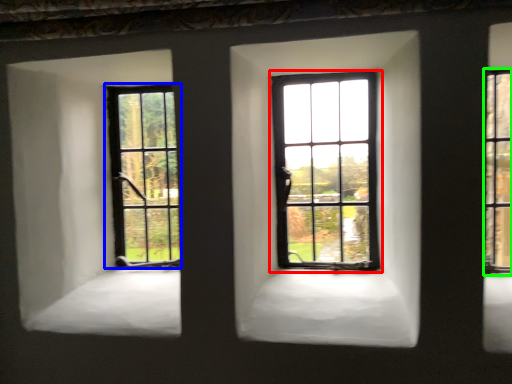
Question: Estimate the real-world distances between objects in this image. Which object is farther from window (highlighted by a red box), window (highlighted by a blue box) or window (highlighted by a green box)?

Choices:
 (A) window
 (B) window

Answer: (B)